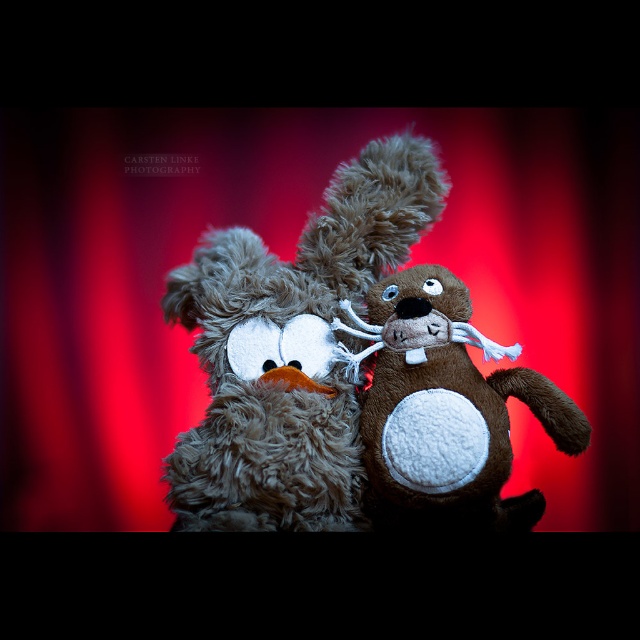
Can you confirm if red velvet curtain at center is thinner than fuzzy brown teddy bear at center?

No, red velvet curtain at center is not thinner than fuzzy brown teddy bear at center.

Who is positioned more to the left, red velvet curtain at center or fuzzy brown teddy bear at center?

Positioned to the left is fuzzy brown teddy bear at center.

Between point (195, 408) and point (301, 376), which one is positioned behind?

The point (195, 408) is more distant.

You are a GUI agent. You are given a task and a screenshot of the screen. Output one action in this format:
    pyautogui.click(x=<x>, y=<y>)
    Task: Click on the red velvet curtain at center
    
    Given the screenshot: What is the action you would take?
    pyautogui.click(x=291, y=259)

Does fuzzy brown teddy bear at center have a greater width compared to brown plush toy at center?

Yes, fuzzy brown teddy bear at center is wider than brown plush toy at center.

Can you confirm if fuzzy brown teddy bear at center is positioned below brown plush toy at center?

Actually, fuzzy brown teddy bear at center is above brown plush toy at center.

Find the location of a particular element. The height and width of the screenshot is (640, 640). fuzzy brown teddy bear at center is located at coordinates (291, 349).

Find the location of a particular element. The height and width of the screenshot is (640, 640). fuzzy brown teddy bear at center is located at coordinates (291, 349).

Looking at this image, does red velvet curtain at center have a smaller size compared to brown plush toy at center?

No.

Where is `red velvet curtain at center`? The height and width of the screenshot is (640, 640). red velvet curtain at center is located at coordinates (291, 259).